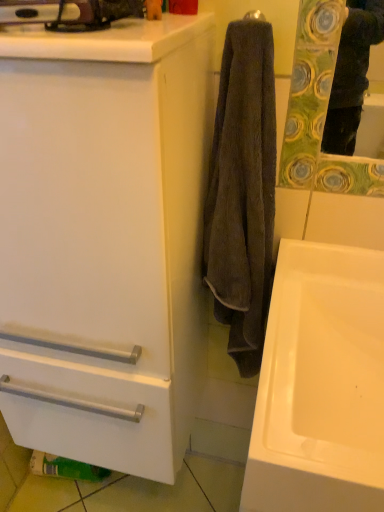
Find the location of a particular element. This screenshot has width=384, height=512. empty space that is ontop of white glossy sink at lower right (from a real-world perspective) is located at coordinates tap(306, 289).